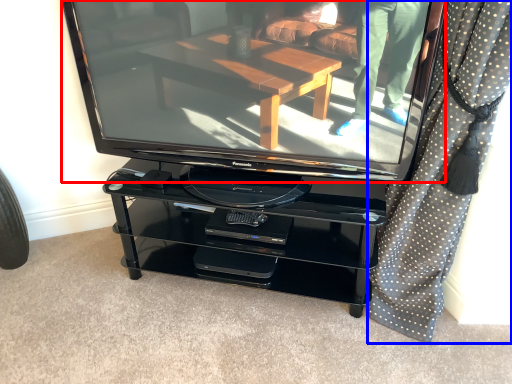
Question: Which object is closer to the camera taking this photo, television (highlighted by a red box) or curtain (highlighted by a blue box)?

Choices:
 (A) television
 (B) curtain

Answer: (B)